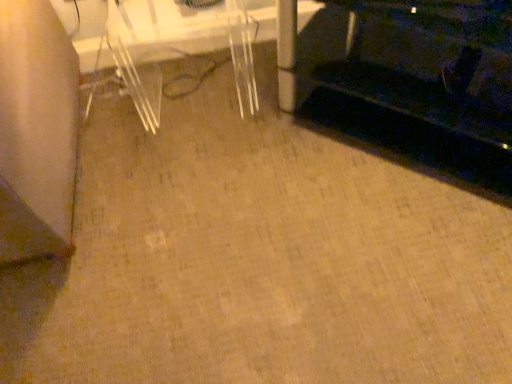
The width and height of the screenshot is (512, 384). What do you see at coordinates (166, 44) in the screenshot?
I see `clear plastic table at center` at bounding box center [166, 44].

Locate an element on the screen. This screenshot has width=512, height=384. clear plastic table at center is located at coordinates pyautogui.click(x=166, y=44).

Measure the distance between point [128,37] and camera.

5.88 feet.

The image size is (512, 384). I want to click on black fabric couch at lower right, so click(425, 86).

What do you see at coordinates (425, 86) in the screenshot? I see `black fabric couch at lower right` at bounding box center [425, 86].

Find the location of a particular element. The width and height of the screenshot is (512, 384). clear plastic table at center is located at coordinates (166, 44).

Is clear plastic table at center at the right side of black fabric couch at lower right?

No, clear plastic table at center is not to the right of black fabric couch at lower right.

In the image, is clear plastic table at center positioned in front of or behind black fabric couch at lower right?

Clearly, clear plastic table at center is behind black fabric couch at lower right.

Does point (169, 0) come in front of point (403, 82)?

No, (169, 0) is further to viewer.

From the image's perspective, who appears lower, clear plastic table at center or black fabric couch at lower right?

From the image's view, black fabric couch at lower right is below.

From a real-world perspective, which object rests below the other?

clear plastic table at center, from a real-world perspective.

Considering the relative sizes of clear plastic table at center and black fabric couch at lower right in the image provided, is clear plastic table at center wider than black fabric couch at lower right?

Incorrect, the width of clear plastic table at center does not surpass that of black fabric couch at lower right.

Between clear plastic table at center and black fabric couch at lower right, which one has more height?

Standing taller between the two is black fabric couch at lower right.

Does clear plastic table at center have a larger size compared to black fabric couch at lower right?

No, clear plastic table at center is not bigger than black fabric couch at lower right.

Do you think clear plastic table at center is within black fabric couch at lower right, or outside of it?

clear plastic table at center is spatially situated outside black fabric couch at lower right.

From the picture: Would you say clear plastic table at center is a long distance from black fabric couch at lower right?

No, there isn't a large distance between clear plastic table at center and black fabric couch at lower right.

Does clear plastic table at center turn towards black fabric couch at lower right?

No, clear plastic table at center is not aimed at black fabric couch at lower right.

In the scene shown: How different are the orientations of clear plastic table at center and black fabric couch at lower right in degrees?

There is a 42.6-degree angle between the facing directions of clear plastic table at center and black fabric couch at lower right.

How much distance is there between clear plastic table at center and black fabric couch at lower right?

clear plastic table at center is 25.18 inches away from black fabric couch at lower right.

This screenshot has height=384, width=512. I want to click on table on the left of black fabric couch at lower right, so click(166, 44).

Is black fabric couch at lower right to the left of clear plastic table at center from the viewer's perspective?

No.

Is the depth of black fabric couch at lower right less than that of clear plastic table at center?

Yes, black fabric couch at lower right is closer to the camera.

Which is closer to the camera, (386, 132) or (103, 63)?

Clearly, point (386, 132) is closer to the camera than point (103, 63).

From the image's perspective, between black fabric couch at lower right and clear plastic table at center, which one is located above?

clear plastic table at center is shown above in the image.

From a real-world perspective, does black fabric couch at lower right stand above clear plastic table at center?

Yes, from a real-world perspective, black fabric couch at lower right is over clear plastic table at center

Which object is wider, black fabric couch at lower right or clear plastic table at center?

With larger width is black fabric couch at lower right.

Which of these two, black fabric couch at lower right or clear plastic table at center, stands shorter?

Standing shorter between the two is clear plastic table at center.

Between black fabric couch at lower right and clear plastic table at center, which one has smaller size?

Smaller between the two is clear plastic table at center.

Is black fabric couch at lower right completely or partially outside of clear plastic table at center?

Yes, black fabric couch at lower right is not within clear plastic table at center.

Is black fabric couch at lower right positioned far away from clear plastic table at center?

They are positioned close to each other.

Is black fabric couch at lower right aimed at clear plastic table at center?

No, black fabric couch at lower right is not turned towards clear plastic table at center.

How many degrees apart are the facing directions of black fabric couch at lower right and clear plastic table at center?

black fabric couch at lower right and clear plastic table at center are facing 42.6 degrees away from each other.

Measure the distance from black fabric couch at lower right to clear plastic table at center.

black fabric couch at lower right is 25.18 inches from clear plastic table at center.

You are a GUI agent. You are given a task and a screenshot of the screen. Output one action in this format:
    pyautogui.click(x=<x>, y=<y>)
    Task: Click on the furniture lying in front of the clear plastic table at center
    
    Given the screenshot: What is the action you would take?
    pyautogui.click(x=425, y=86)

In the image, there is a black fabric couch at lower right. Find the location of `table above it (from the image's perspective)`. table above it (from the image's perspective) is located at coordinates (166, 44).

Identify the location of furniture above the clear plastic table at center (from a real-world perspective). (425, 86).